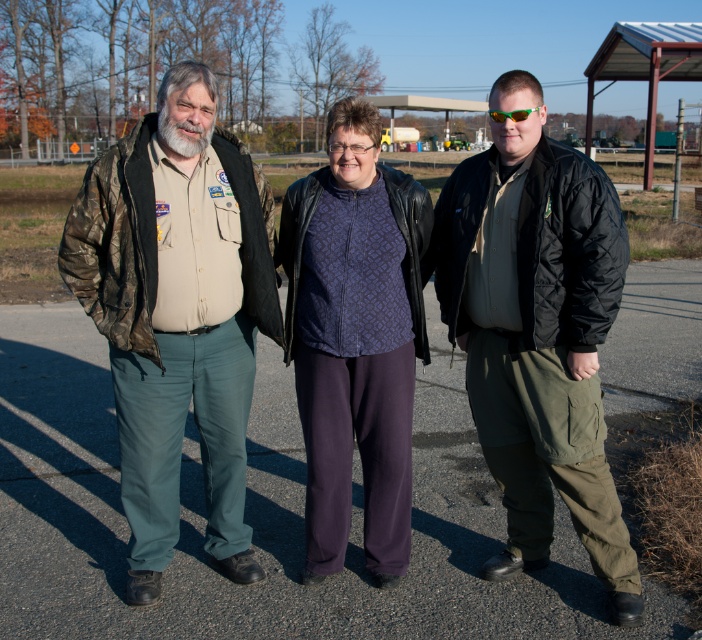
Question: Is dark gray asphalt at center smaller than purple patterned shirt at center?

Choices:
 (A) yes
 (B) no

Answer: (B)

Question: Which point appears farthest from the camera in this image?

Choices:
 (A) (84, 634)
 (B) (133, 548)
 (C) (380, 432)

Answer: (B)

Question: Does dark gray asphalt at center appear over black quilted jacket at right?

Choices:
 (A) yes
 (B) no

Answer: (A)

Question: Considering the relative positions of dark gray asphalt at center and black quilted jacket at right in the image provided, where is dark gray asphalt at center located with respect to black quilted jacket at right?

Choices:
 (A) above
 (B) below

Answer: (A)

Question: Which object appears closest to the camera in this image?

Choices:
 (A) purple patterned shirt at center
 (B) black quilted jacket at right
 (C) dark gray asphalt at center
 (D) camo jacket at left

Answer: (B)

Question: Which point is closer to the camera taking this photo?

Choices:
 (A) (510, 186)
 (B) (66, 532)

Answer: (A)